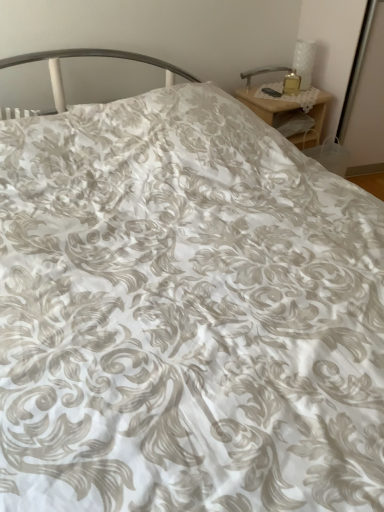
Question: Considering the relative sizes of white textured vase at upper right, acting as the 2th table lamp starting from the left, and wooden nightstand at upper right in the image provided, is white textured vase at upper right, acting as the 2th table lamp starting from the left, smaller than wooden nightstand at upper right?

Choices:
 (A) yes
 (B) no

Answer: (A)

Question: Is white textured vase at upper right, acting as the 2th table lamp starting from the left, in contact with wooden nightstand at upper right?

Choices:
 (A) yes
 (B) no

Answer: (B)

Question: Considering the relative positions of white textured vase at upper right, acting as the 2th table lamp starting from the left, and wooden nightstand at upper right in the image provided, is white textured vase at upper right, acting as the 2th table lamp starting from the left, to the left of wooden nightstand at upper right from the viewer's perspective?

Choices:
 (A) no
 (B) yes

Answer: (A)

Question: Does white textured vase at upper right, acting as the first table lamp starting from the right, have a lesser height compared to wooden nightstand at upper right?

Choices:
 (A) yes
 (B) no

Answer: (A)

Question: Is wooden nightstand at upper right at the back of white textured vase at upper right, acting as the 2th table lamp starting from the left?

Choices:
 (A) no
 (B) yes

Answer: (A)

Question: In terms of height, does metallic silver table lamp at upper right, marked as the 1th table lamp in a left-to-right arrangement, look taller or shorter compared to wooden nightstand at upper right?

Choices:
 (A) short
 (B) tall

Answer: (A)

Question: Is point (248, 73) closer or farther from the camera than point (251, 102)?

Choices:
 (A) farther
 (B) closer

Answer: (A)

Question: In the image, is metallic silver table lamp at upper right, marked as the 1th table lamp in a left-to-right arrangement, on the left side or the right side of wooden nightstand at upper right?

Choices:
 (A) left
 (B) right

Answer: (A)

Question: Is metallic silver table lamp at upper right, which is the 2th table lamp from right to left, wider or thinner than wooden nightstand at upper right?

Choices:
 (A) thin
 (B) wide

Answer: (A)

Question: Considering the positions of wooden nightstand at upper right and metallic silver table lamp at upper right, marked as the 1th table lamp in a left-to-right arrangement, in the image, is wooden nightstand at upper right bigger or smaller than metallic silver table lamp at upper right, marked as the 1th table lamp in a left-to-right arrangement,?

Choices:
 (A) big
 (B) small

Answer: (A)

Question: Does point (283, 101) appear closer or farther from the camera than point (273, 71)?

Choices:
 (A) farther
 (B) closer

Answer: (B)

Question: In terms of height, does wooden nightstand at upper right look taller or shorter compared to metallic silver table lamp at upper right, which is the 2th table lamp from right to left?

Choices:
 (A) short
 (B) tall

Answer: (B)

Question: Is wooden nightstand at upper right in front of or behind metallic silver table lamp at upper right, marked as the 1th table lamp in a left-to-right arrangement, in the image?

Choices:
 (A) front
 (B) behind

Answer: (A)

Question: Considering the positions of metallic silver table lamp at upper right, marked as the 1th table lamp in a left-to-right arrangement, and white textured vase at upper right, acting as the first table lamp starting from the right, in the image, is metallic silver table lamp at upper right, marked as the 1th table lamp in a left-to-right arrangement, wider or thinner than white textured vase at upper right, acting as the first table lamp starting from the right,?

Choices:
 (A) wide
 (B) thin

Answer: (B)

Question: Is metallic silver table lamp at upper right, marked as the 1th table lamp in a left-to-right arrangement, to the left or to the right of white textured vase at upper right, acting as the 2th table lamp starting from the left, in the image?

Choices:
 (A) right
 (B) left

Answer: (B)